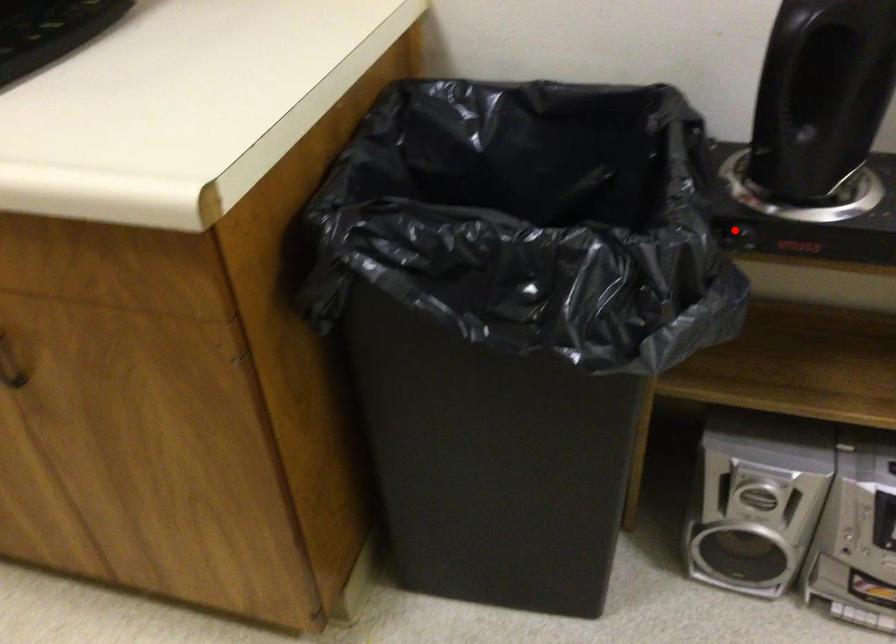
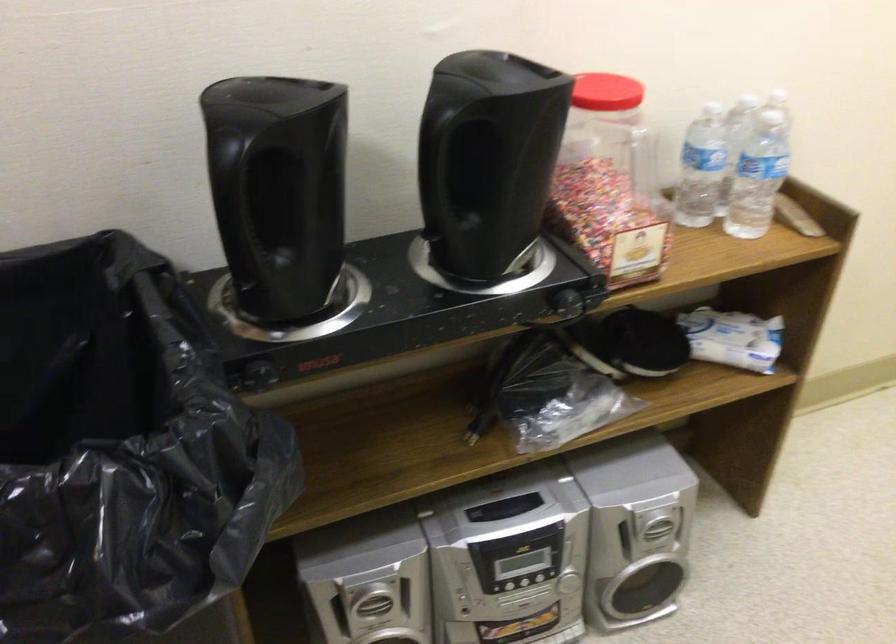
Locate, in the second image, the point that corresponds to the highlighted location in the first image.

(259, 375)